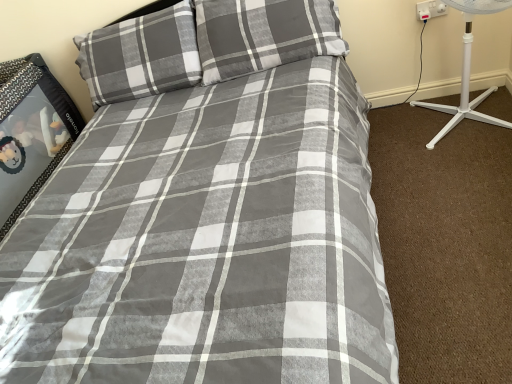
Question: From a real-world perspective, is white plastic socket at upper right above or below gray cotton pillow at upper center, the 1th pillow viewed from the right?

Choices:
 (A) above
 (B) below

Answer: (B)

Question: Based on their sizes in the image, would you say white plastic socket at upper right is bigger or smaller than gray cotton pillow at upper center, the 1th pillow viewed from the right?

Choices:
 (A) big
 (B) small

Answer: (B)

Question: Considering the real-world distances, which object is farthest from the white plastic socket at upper right?

Choices:
 (A) white plastic fan at right
 (B) gray plaid pillow at upper left, the second pillow when ordered from right to left
 (C) gray cotton pillow at upper center, the 1th pillow viewed from the right

Answer: (B)

Question: Estimate the real-world distances between objects in this image. Which object is farther from the white plastic socket at upper right?

Choices:
 (A) white plastic fan at right
 (B) gray cotton pillow at upper center, the 1th pillow viewed from the right
 (C) gray plaid pillow at upper left, the first pillow in the left-to-right sequence

Answer: (C)